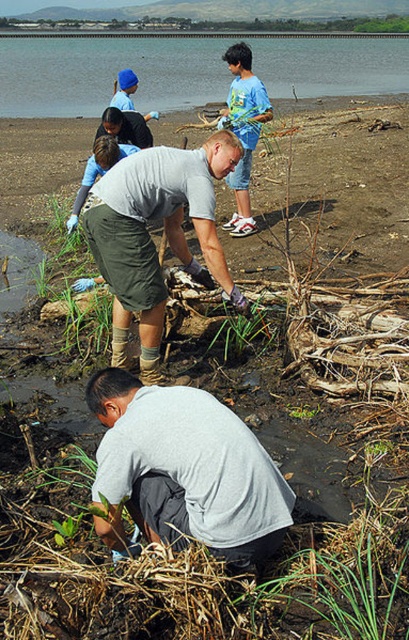
Between gray matte shorts at center and green grass at center, which one is positioned higher?

Positioned higher is gray matte shorts at center.

Is gray matte shorts at center above green grass at center?

Yes.

The image size is (409, 640). Identify the location of gray matte shorts at center. (150, 237).

Locate an element on the screen. This screenshot has width=409, height=640. gray matte shorts at center is located at coordinates (150, 237).

From the picture: Is gray matte shirt at lower center below gray matte shorts at center?

Indeed, gray matte shirt at lower center is positioned under gray matte shorts at center.

Can you confirm if gray matte shirt at lower center is taller than gray matte shorts at center?

No.

Is point (109, 428) positioned in front of point (112, 195)?

That is True.

Find the location of a particular element. gray matte shirt at lower center is located at coordinates (184, 470).

Can you confirm if clear water at upper center is smaller than green grass at center?

Incorrect, clear water at upper center is not smaller in size than green grass at center.

Which of these two, clear water at upper center or green grass at center, stands taller?

clear water at upper center is taller.

Identify the location of clear water at upper center. The height and width of the screenshot is (640, 409). (107, 74).